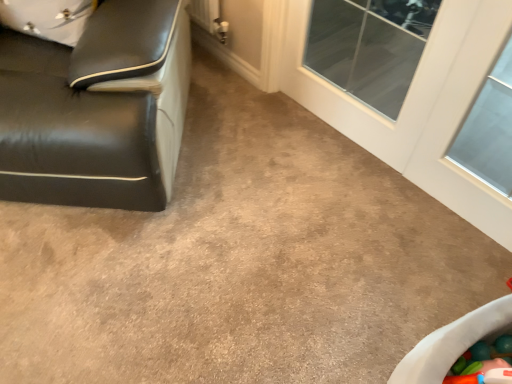
What do you see at coordinates (97, 109) in the screenshot?
I see `black leather couch at left` at bounding box center [97, 109].

Locate an element on the screen. Image resolution: width=512 pixels, height=384 pixels. black leather couch at left is located at coordinates (97, 109).

This screenshot has height=384, width=512. Identify the location of transparent glass door at upper right. (417, 105).

Describe the element at coordinates (417, 105) in the screenshot. The height and width of the screenshot is (384, 512). I see `transparent glass door at upper right` at that location.

Where is `black leather couch at left`? black leather couch at left is located at coordinates (97, 109).

Based on their positions, is black leather couch at left located to the left or right of transparent glass door at upper right?

black leather couch at left is to the left of transparent glass door at upper right.

Which object is more forward, black leather couch at left or transparent glass door at upper right?

black leather couch at left.

Does point (86, 150) come closer to viewer compared to point (483, 183)?

That is True.

From the image's perspective, which one is positioned higher, black leather couch at left or transparent glass door at upper right?

black leather couch at left is shown above in the image.

From a real-world perspective, is black leather couch at left positioned under transparent glass door at upper right based on gravity?

No, from a real-world perspective, black leather couch at left is not under transparent glass door at upper right.

Is black leather couch at left wider or thinner than transparent glass door at upper right?

black leather couch at left is wider than transparent glass door at upper right.

Considering the relative sizes of black leather couch at left and transparent glass door at upper right in the image provided, is black leather couch at left shorter than transparent glass door at upper right?

No, black leather couch at left is not shorter than transparent glass door at upper right.

Who is bigger, black leather couch at left or transparent glass door at upper right?

With larger size is black leather couch at left.

Choose the correct answer: Is black leather couch at left inside transparent glass door at upper right or outside it?

black leather couch at left is outside transparent glass door at upper right.

Is black leather couch at left not near transparent glass door at upper right?

Actually, black leather couch at left and transparent glass door at upper right are a little close together.

Is black leather couch at left facing towards transparent glass door at upper right?

No.

At what (x,y) coordinates should I click in order to perform the action: click on furniture above the transparent glass door at upper right (from the image's perspective). Please return your answer as a coordinate pair (x, y). This screenshot has width=512, height=384. Looking at the image, I should click on (97, 109).

In the image, is transparent glass door at upper right on the left side or the right side of black leather couch at left?

In the image, transparent glass door at upper right appears on the right side of black leather couch at left.

Does transparent glass door at upper right come in front of black leather couch at left?

No, transparent glass door at upper right is behind black leather couch at left.

Which is in front, point (305, 102) or point (42, 55)?

The point (42, 55) is in front.

In the scene shown: From the image's perspective, which is below, transparent glass door at upper right or black leather couch at left?

transparent glass door at upper right is shown below in the image.

From a real-world perspective, between transparent glass door at upper right and black leather couch at left, who is vertically lower?

In real-world perspective, transparent glass door at upper right is lower.

Considering the sizes of objects transparent glass door at upper right and black leather couch at left in the image provided, who is wider, transparent glass door at upper right or black leather couch at left?

Wider between the two is black leather couch at left.

Can you confirm if transparent glass door at upper right is taller than black leather couch at left?

No, transparent glass door at upper right is not taller than black leather couch at left.

Between transparent glass door at upper right and black leather couch at left, which one has larger size?

black leather couch at left.

Which is correct: transparent glass door at upper right is inside black leather couch at left, or outside of it?

transparent glass door at upper right is not enclosed by black leather couch at left.

Is transparent glass door at upper right touching black leather couch at left?

transparent glass door at upper right is not next to black leather couch at left, and they're not touching.

Does transparent glass door at upper right turn towards black leather couch at left?

Yes, transparent glass door at upper right is oriented towards black leather couch at left.

Consider the image. How much distance is there between transparent glass door at upper right and black leather couch at left?

The distance of transparent glass door at upper right from black leather couch at left is 34.31 inches.

Image resolution: width=512 pixels, height=384 pixels. Find the location of `furniture above the transparent glass door at upper right (from the image's perspective)`. furniture above the transparent glass door at upper right (from the image's perspective) is located at coordinates (97, 109).

The height and width of the screenshot is (384, 512). I want to click on furniture in front of the transparent glass door at upper right, so click(97, 109).

In order to click on glass door that appears below the black leather couch at left (from the image's perspective) in this screenshot , I will do `click(417, 105)`.